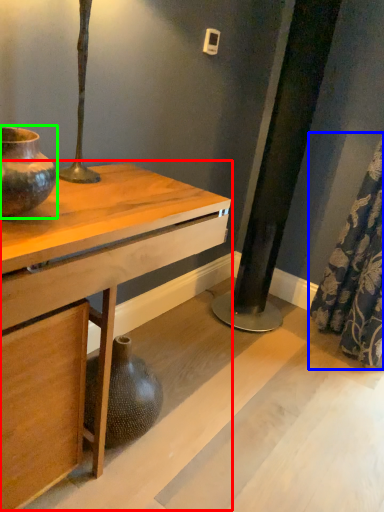
Question: Which object is positioned closest to table (highlighted by a red box)? Select from shower curtain (highlighted by a blue box) and vase (highlighted by a green box).

Choices:
 (A) shower curtain
 (B) vase

Answer: (B)